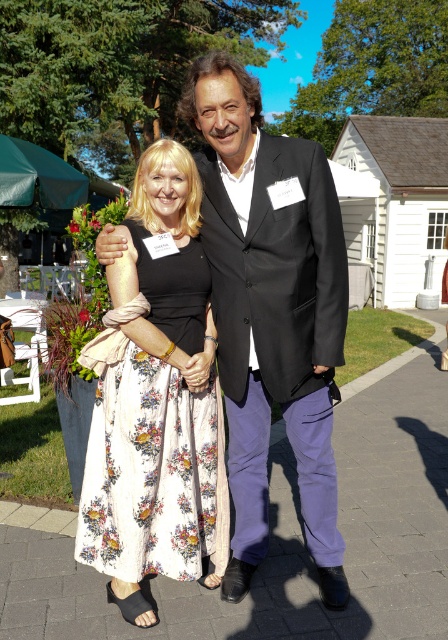
You are planning to place a small potted plant on the white concrete pavement at center. Considering the space available, will the floral cotton dress at center interfere with the placement?

The white concrete pavement at center occupies less space than the floral cotton dress at center, so placing a potted plant there may be challenging due to limited space and potential interference from the dress.

You are planning to place a 1.2 meter wide decorative panel on the ground between the white concrete pavement at center and the floral cotton dress at center. Based on the available space, will the panel fit without overlapping either object?

The white concrete pavement at center might be wider than the floral cotton dress at center, so the 1.2 meter wide decorative panel may or may not fit depending on the exact width difference. Since the description states the pavement might be wider, there is a possibility it could accommodate the panel, but uncertainty remains without precise measurements.

You are planning to place a 1.5 meter wide banner on the white concrete pavement at center. Considering the width of the black satin suit at center, will the banner fit entirely on the pavement without overlapping it?

The white concrete pavement at center is wider than the black satin suit at center. Since the banner is 1.5 meters wide, it can fit entirely on the pavement as long as it doesn not overlap the suit.